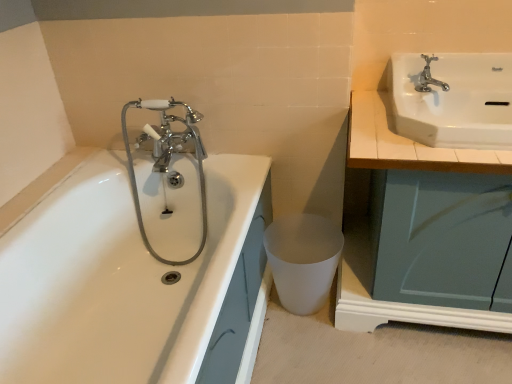
Question: In the image, is chrome/metallic faucet at left positioned in front of or behind white wood countertop at upper right?

Choices:
 (A) front
 (B) behind

Answer: (B)

Question: Looking at their shapes, would you say chrome/metallic faucet at left is wider or thinner than white wood countertop at upper right?

Choices:
 (A) wide
 (B) thin

Answer: (B)

Question: Which of these objects is positioned farthest from the white wood countertop at upper right?

Choices:
 (A) white glossy bathtub at left
 (B) white matte plastic at lower center
 (C) chrome/metallic faucet at left
 (D) chrome metallic faucet at upper right
 (E) white glossy sink at upper right

Answer: (C)

Question: Which object is the farthest from the chrome/metallic faucet at left?

Choices:
 (A) white glossy sink at upper right
 (B) chrome metallic faucet at upper right
 (C) white wood countertop at upper right
 (D) white glossy bathtub at left
 (E) white matte plastic at lower center

Answer: (B)